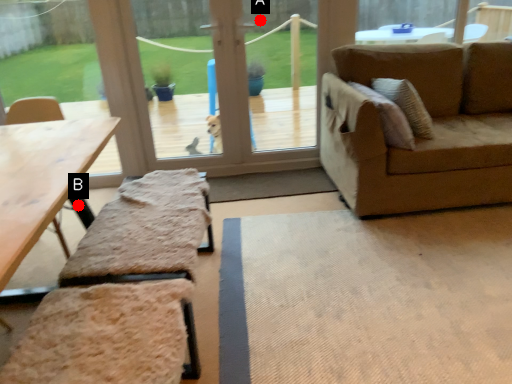
Question: Two points are circled on the image, labeled by A and B beside each circle. Which of the following is the farthest from the observer?

Choices:
 (A) A is further
 (B) B is further

Answer: (A)